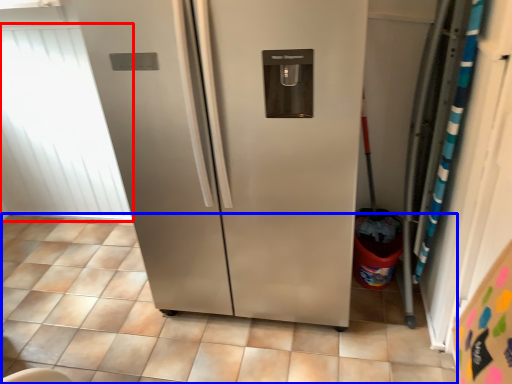
Question: Which of the following is the closest to the observer, window screen (highlighted by a red box) or tile (highlighted by a blue box)?

Choices:
 (A) window screen
 (B) tile

Answer: (B)